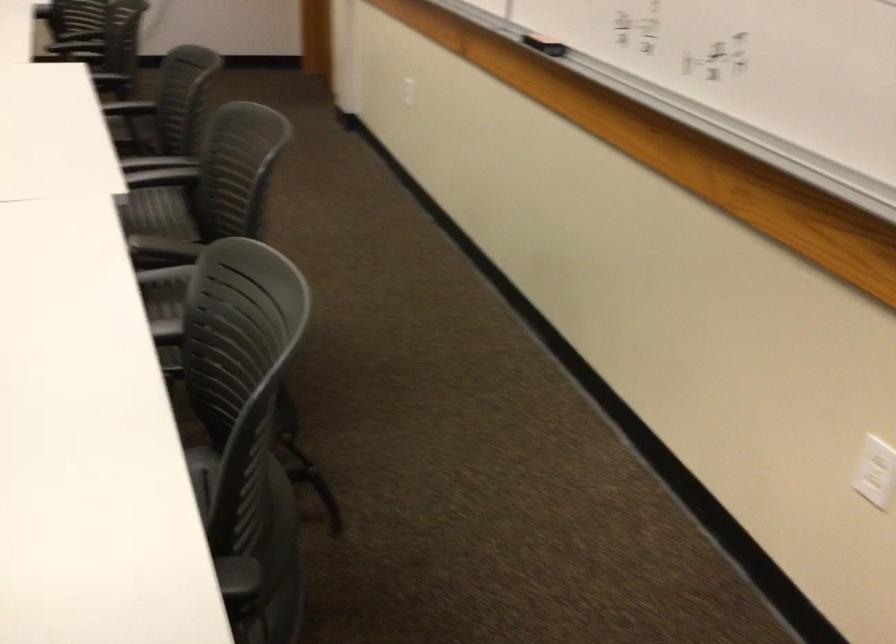
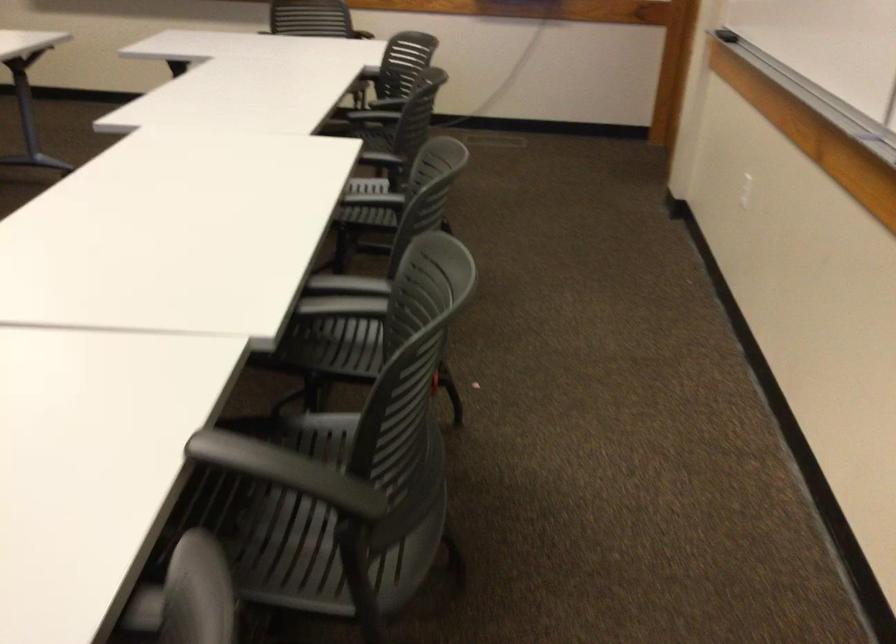
Locate, in the second image, the point that corresponds to (168,172) in the first image.

(343, 297)